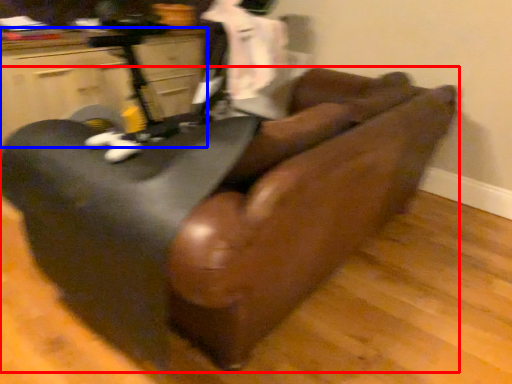
Question: Which object appears closest to the camera in this image, furniture (highlighted by a red box) or furniture (highlighted by a blue box)?

Choices:
 (A) furniture
 (B) furniture

Answer: (A)